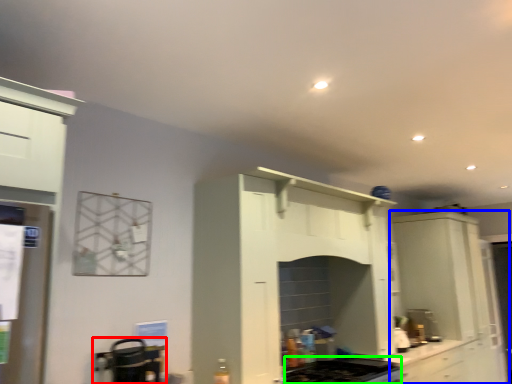
Question: Which object is the closest to the appliance (highlighted by a red box)? Choose among these: cabinetry (highlighted by a blue box) or gas stove (highlighted by a green box).

Choices:
 (A) cabinetry
 (B) gas stove

Answer: (B)